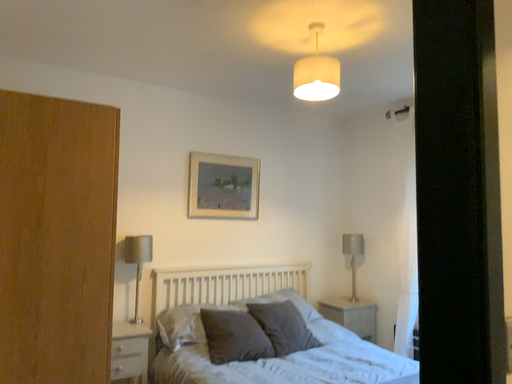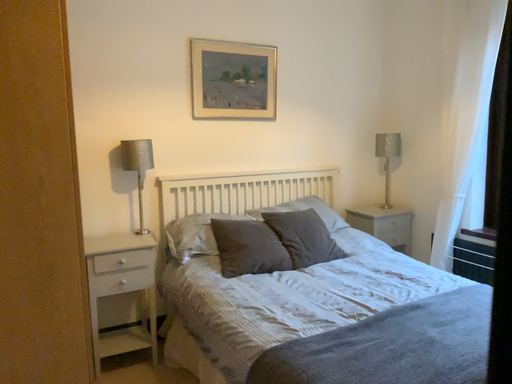
Question: How did the camera likely rotate when shooting the video?

Choices:
 (A) rotated upward
 (B) rotated downward

Answer: (B)